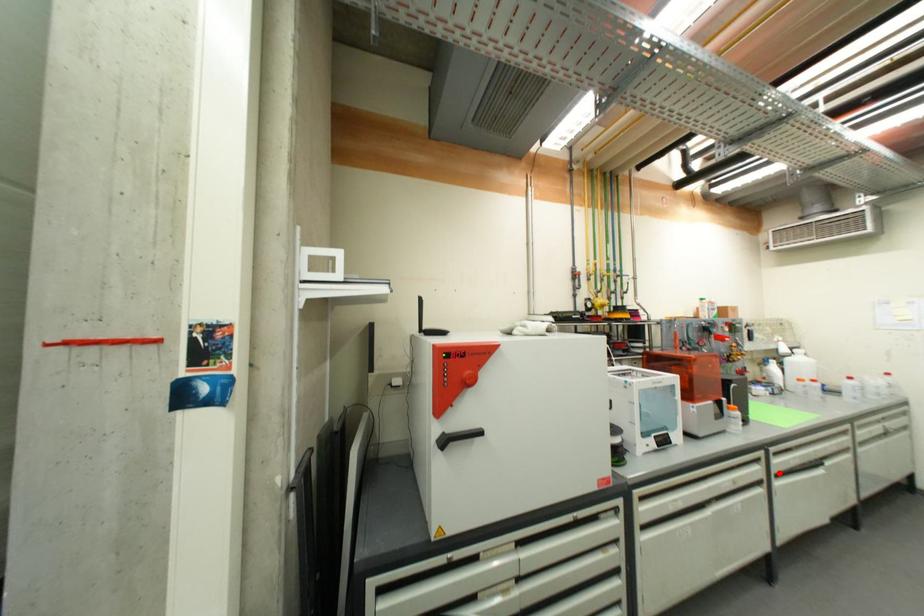
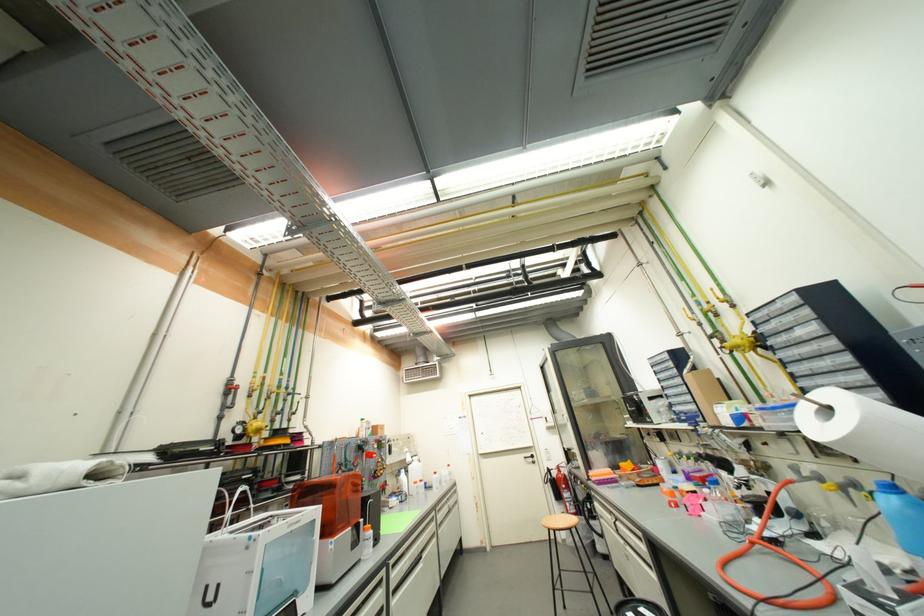
In the second image, find the point that corresponds to the highlighted location in the first image.

(396, 590)